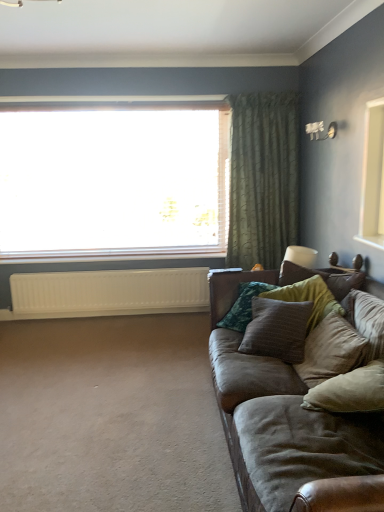
Question: Is velvet beige pillow at right, the 2th pillow when ordered from back to front, taller or shorter than beige fabric pillow at lower right, the 1th pillow in the front-to-back sequence?

Choices:
 (A) short
 (B) tall

Answer: (B)

Question: Which is correct: velvet beige pillow at right, arranged as the second pillow when viewed from the front, is inside beige fabric pillow at lower right, which ranks as the third pillow in back-to-front order, or outside of it?

Choices:
 (A) inside
 (B) outside

Answer: (B)

Question: Which of these objects is positioned closest to the velvet beige pillow at right, arranged as the second pillow when viewed from the front?

Choices:
 (A) beige fabric pillow at lower right, which ranks as the third pillow in back-to-front order
 (B) white plastic light fixture at upper right
 (C) transparent glass window at upper center
 (D) brown suede couch at right
 (E) white matte radiator at lower left

Answer: (A)

Question: Which is nearer to the green textured curtain at upper right?

Choices:
 (A) velvet beige pillow at right, arranged as the second pillow when viewed from the front
 (B) transparent glass window at upper center
 (C) beige fabric pillow at lower right, which ranks as the third pillow in back-to-front order
 (D) white matte radiator at lower left
 (E) textured brown pillow at right, arranged as the 1th pillow when viewed from the back

Answer: (B)